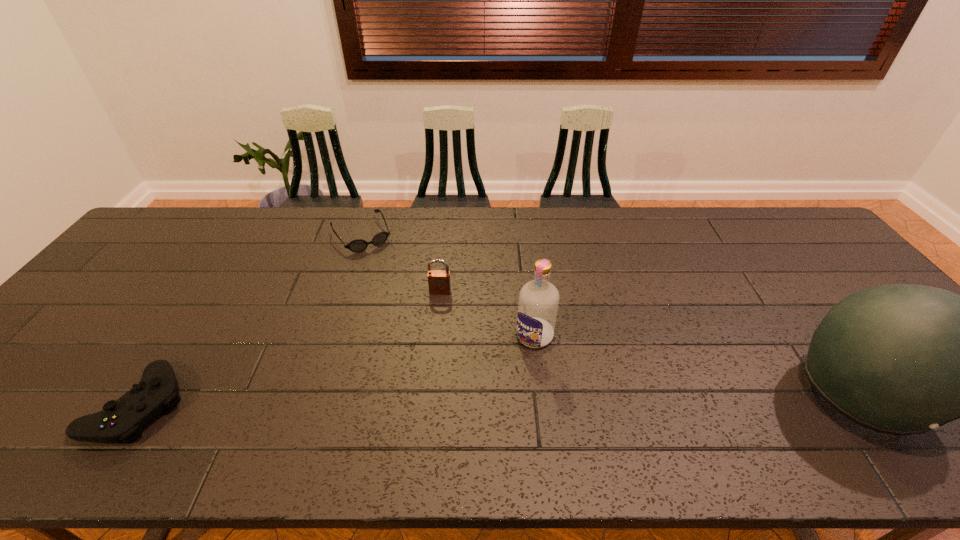
This screenshot has height=540, width=960. In order to click on vacant space situated 0.180m on the label of the vodka in this screenshot , I will do `click(484, 401)`.

The width and height of the screenshot is (960, 540). Identify the location of vacant space located 0.210m on the label of the vodka. (477, 410).

I want to click on vacant space situated on the front-facing side of the padlock, so click(437, 310).

The width and height of the screenshot is (960, 540). Find the location of `vacant space located 0.270m on the front-facing side of the padlock`. vacant space located 0.270m on the front-facing side of the padlock is located at coordinates (428, 375).

You are a GUI agent. You are given a task and a screenshot of the screen. Output one action in this format:
    pyautogui.click(x=<x>, y=<y>)
    Task: Click on the vacant area located on the front-facing side of the padlock
    This screenshot has width=960, height=540.
    Given the screenshot: What is the action you would take?
    pyautogui.click(x=427, y=378)

Where is `blank space located on the lenses of the second object from left to right`? Image resolution: width=960 pixels, height=540 pixels. blank space located on the lenses of the second object from left to right is located at coordinates (414, 316).

I want to click on free region located 0.250m on the lenses of the second object from left to right, so click(403, 301).

This screenshot has height=540, width=960. Find the location of `vacant space located on the lenses of the second object from left to right`. vacant space located on the lenses of the second object from left to right is located at coordinates [403, 301].

Locate an element on the screen. This screenshot has height=540, width=960. object located at the far edge is located at coordinates (358, 245).

This screenshot has width=960, height=540. In order to click on object that is at the near edge in this screenshot , I will do `click(123, 420)`.